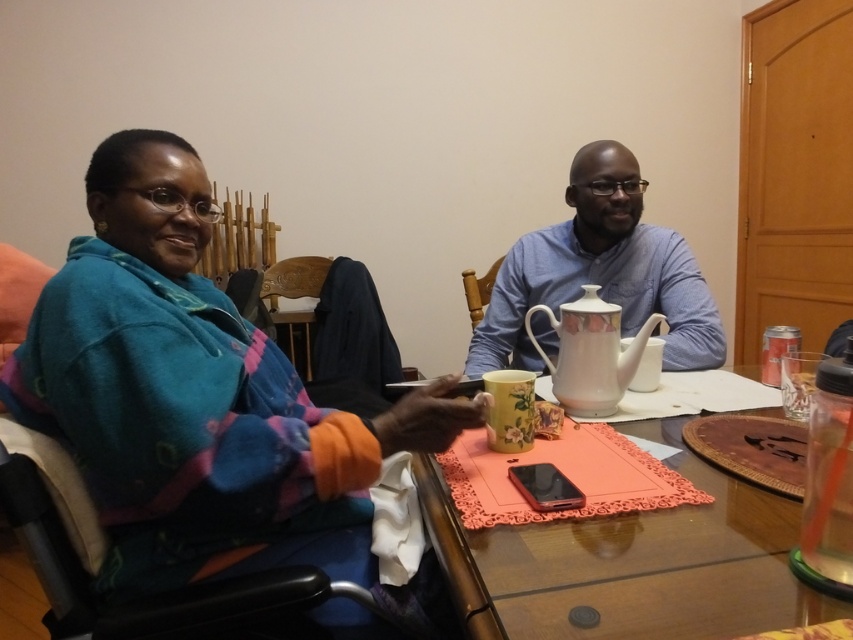
Does point (163, 337) lie in front of point (764, 586)?

No.

Describe the element at coordinates (196, 396) in the screenshot. I see `blue fleece jacket at left` at that location.

Does point (112, 144) lie in front of point (483, 550)?

No, it is behind (483, 550).

The height and width of the screenshot is (640, 853). Find the location of `blue fleece jacket at left`. blue fleece jacket at left is located at coordinates (196, 396).

Who is taller, blue fleece jacket at left or blue cotton shirt at center?

blue fleece jacket at left is taller.

Who is lower down, blue fleece jacket at left or blue cotton shirt at center?

blue fleece jacket at left is lower down.

What do you see at coordinates (196, 396) in the screenshot?
I see `blue fleece jacket at left` at bounding box center [196, 396].

Identify the location of blue fleece jacket at left. (196, 396).

Who is more forward, [660,628] or [605,248]?

Point [660,628] is more forward.

Describe the element at coordinates (654, 566) in the screenshot. I see `matte plastic phone at center` at that location.

Locate an element on the screen. The image size is (853, 640). matte plastic phone at center is located at coordinates (654, 566).